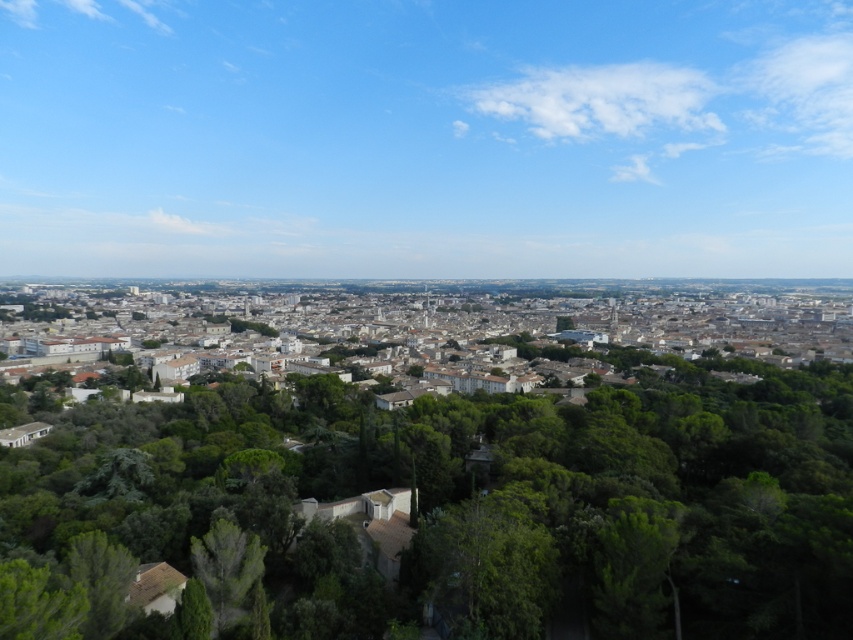
Question: Which object appears farthest from the camera in this image?

Choices:
 (A) green leafy tree at center
 (B) white concrete buildings at center

Answer: (B)

Question: Which object is the farthest from the green leafy tree at center?

Choices:
 (A) white concrete buildings at center
 (B) green leafy tree at lower left

Answer: (A)

Question: Which object is farther from the camera taking this photo?

Choices:
 (A) green leafy tree at lower left
 (B) white concrete buildings at center
 (C) green leafy tree at center

Answer: (B)

Question: Is green leafy tree at center below green leafy tree at lower left?

Choices:
 (A) no
 (B) yes

Answer: (A)

Question: Does green leafy tree at center have a larger size compared to green leafy tree at lower left?

Choices:
 (A) yes
 (B) no

Answer: (A)

Question: Is white concrete buildings at center thinner than green leafy tree at lower left?

Choices:
 (A) yes
 (B) no

Answer: (B)